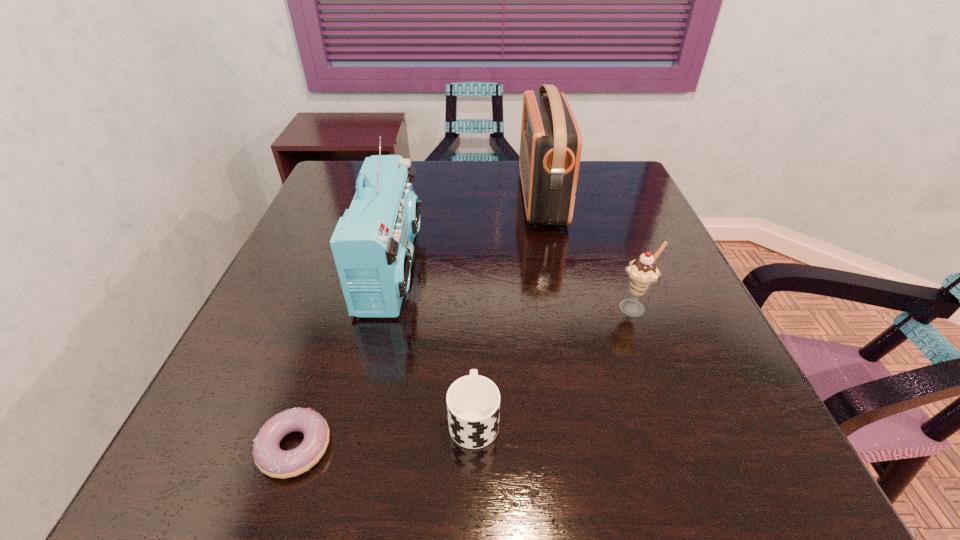
At what (x,y) coordinates should I click in order to perform the action: click on free space between the left radio receiver and the third object from left to right. Please return your answer as a coordinate pair (x, y). The width and height of the screenshot is (960, 540). Looking at the image, I should click on (433, 343).

What are the coordinates of `blank region between the left radio receiver and the third object from right to left` in the screenshot? It's located at (433, 343).

Find the location of a particular element. Image resolution: width=960 pixels, height=540 pixels. vacant area that lies between the left radio receiver and the shortest object is located at coordinates (344, 357).

Identify the location of vacant region between the fourth tallest object and the left radio receiver. (433, 343).

At what (x,y) coordinates should I click in order to perform the action: click on free space that is in between the left radio receiver and the third shortest object. Please return your answer as a coordinate pair (x, y). Looking at the image, I should click on (513, 288).

Find the location of `blank region between the third tallest object and the second object from right to left`. blank region between the third tallest object and the second object from right to left is located at coordinates (588, 253).

Where is `free space between the left radio receiver and the right radio receiver`? free space between the left radio receiver and the right radio receiver is located at coordinates (467, 233).

Point out which object is positioned as the second nearest to the fourth object from left to right. Please provide its 2D coordinates. Your answer should be formatted as a tuple, i.e. [(x, y)], where the tuple contains the x and y coordinates of a point satisfying the conditions above.

[(372, 245)]

I want to click on object that is the second closest one to the cup, so click(372, 245).

The height and width of the screenshot is (540, 960). In order to click on free region that satisfies the following two spatial constraints: 1. on the front-facing side of the right radio receiver; 2. on the back side of the third shortest object in this screenshot , I will do (x=564, y=308).